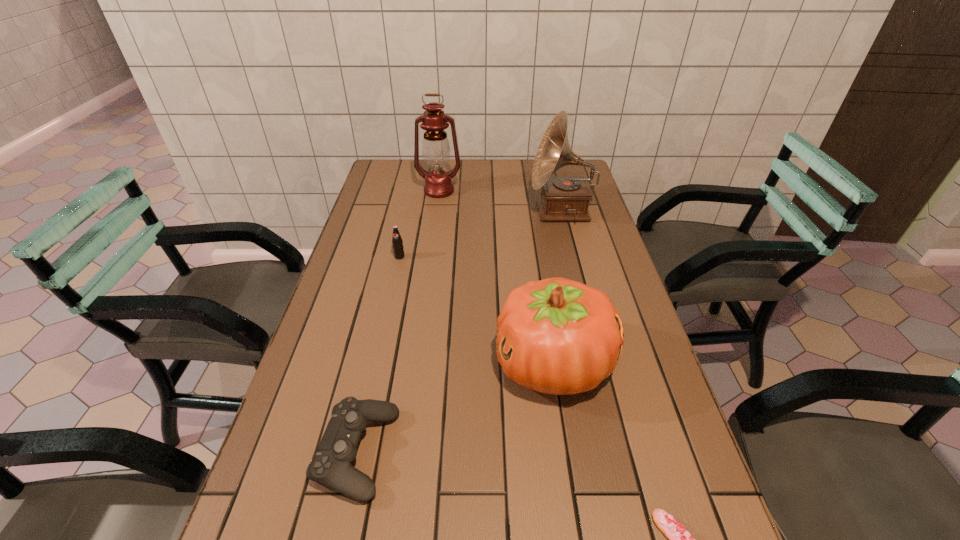
Identify the location of vacant region at the far edge of the desktop. The height and width of the screenshot is (540, 960). (425, 165).

Where is `vacant space at the left edge of the desktop`? The width and height of the screenshot is (960, 540). vacant space at the left edge of the desktop is located at coordinates pos(274,489).

Locate an element on the screen. This screenshot has width=960, height=540. blank area at the right edge is located at coordinates (642, 330).

Identify the location of free space at the far left corner. (399, 187).

In the image, there is a desktop. Identify the location of vacant space at the far right corner. The image size is (960, 540). (571, 166).

Where is `unoccupied position between the second shortest object and the phonograph record`? Image resolution: width=960 pixels, height=540 pixels. unoccupied position between the second shortest object and the phonograph record is located at coordinates (459, 332).

At what (x,y) coordinates should I click in order to perform the action: click on free space between the control and the pumpkin. Please return your answer as a coordinate pair (x, y). The width and height of the screenshot is (960, 540). Looking at the image, I should click on (455, 409).

At what (x,y) coordinates should I click in order to perform the action: click on vacant point located between the pop and the pumpkin. Please return your answer as a coordinate pair (x, y). Looking at the image, I should click on (476, 310).

Image resolution: width=960 pixels, height=540 pixels. In order to click on unoccupied position between the control and the pumpkin in this screenshot , I will do `click(455, 409)`.

Locate an element on the screen. free space between the phonograph record and the control is located at coordinates pyautogui.click(x=459, y=332).